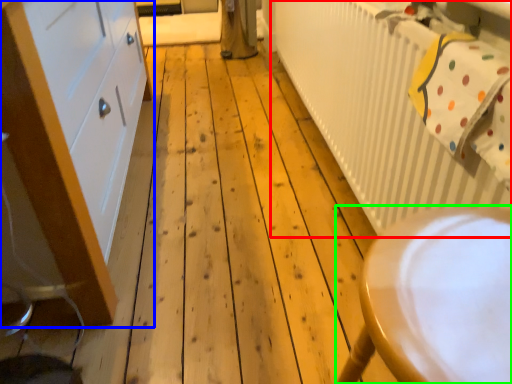
Question: Considering the real-world distances, which object is closest to radiator (highlighted by a red box)? cabinetry (highlighted by a blue box) or furniture (highlighted by a green box).

Choices:
 (A) cabinetry
 (B) furniture

Answer: (B)